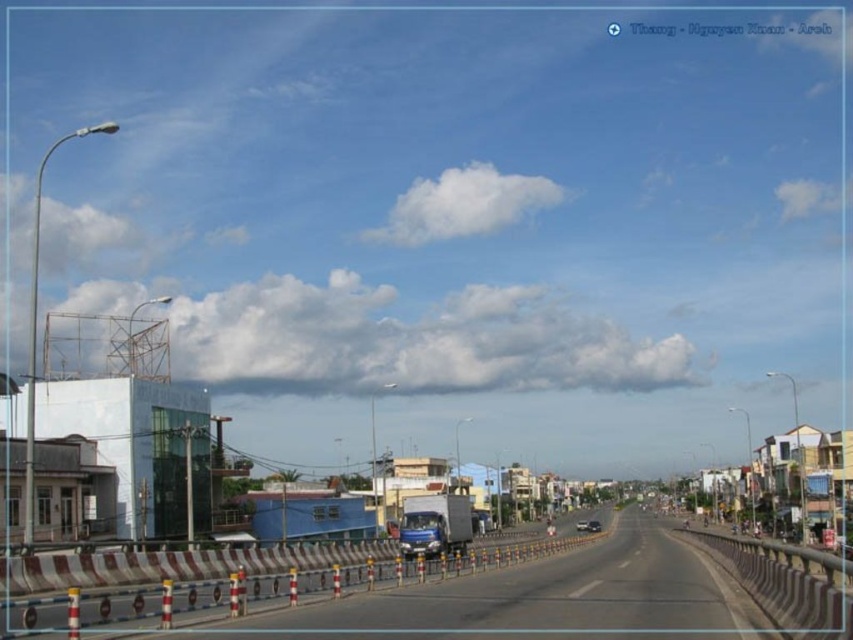
You are a pedestrian standing at the side of the road and see the white plastic barrier at center and the metallic silver sedan at center. Which object is higher from the ground?

The white plastic barrier at center is located above the metallic silver sedan at center, so the white plastic barrier at center is higher from the ground.

You are a delivery driver approaching the road shown in the image. You need to stay within the lanes and avoid obstacles. Where is the metallic gray barrier at lower right located in relation to your current position?

The metallic gray barrier at lower right is located at point (x=784, y=586), which is near the lower right corner of the image. Since you are approaching the road, it is positioned to your right side and slightly ahead, so you should stay within the lanes and avoid drifting towards that area.